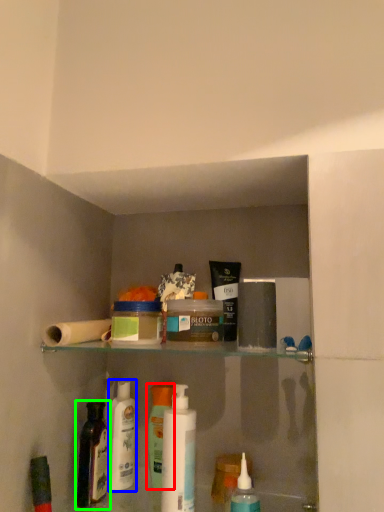
Question: Estimate the real-world distances between objects in this image. Which object is closer to toiletry (highlighted by a red box), toiletry (highlighted by a blue box) or bottle (highlighted by a green box)?

Choices:
 (A) toiletry
 (B) bottle

Answer: (A)